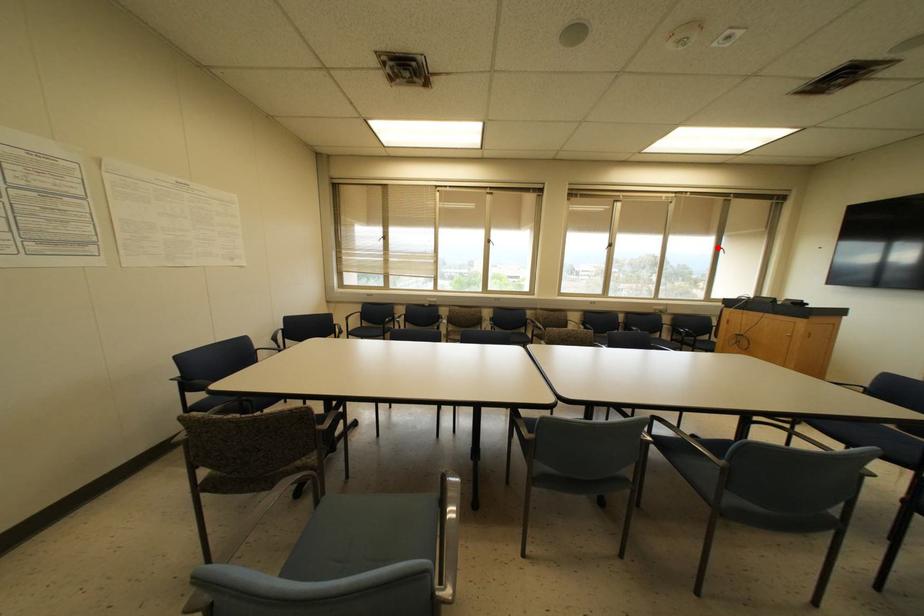
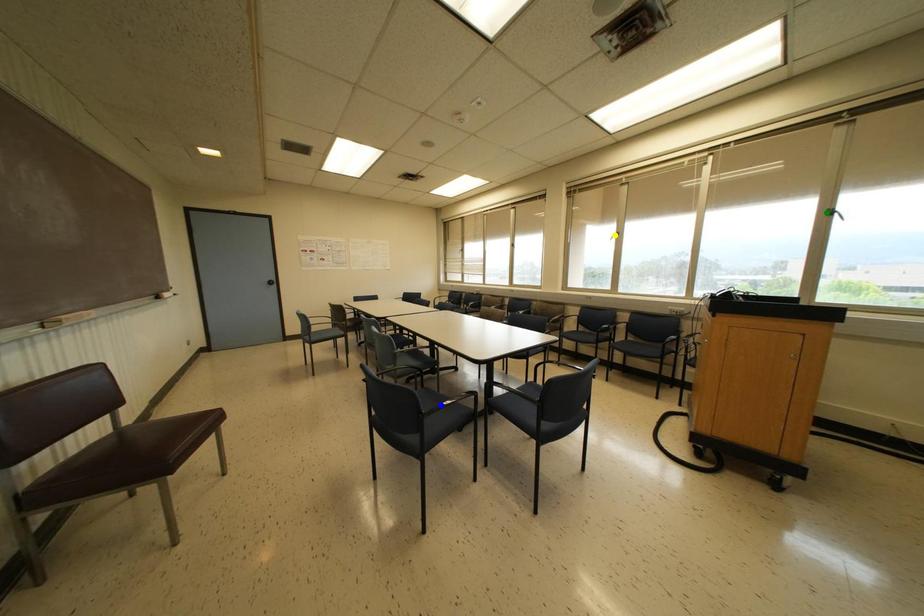
Question: I am providing you with two images of the same scene from different viewpoints. A red point is marked on the first image. You are given multiple points on the second image. Which point in image 2 is actually the same real-world point as the red point in image 1?

Choices:
 (A) blue point
 (B) yellow point
 (C) green point

Answer: (C)